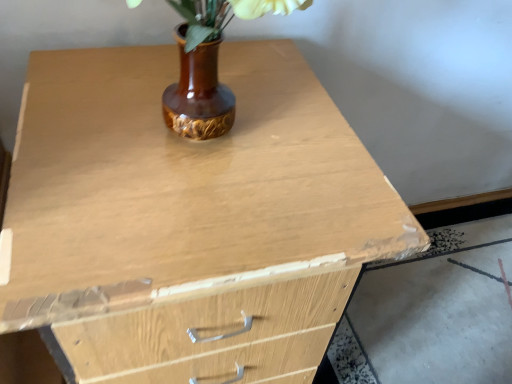
Locate an element on the screen. The width and height of the screenshot is (512, 384). free point to the left of browny-golden ceramic vase at center is located at coordinates (89, 117).